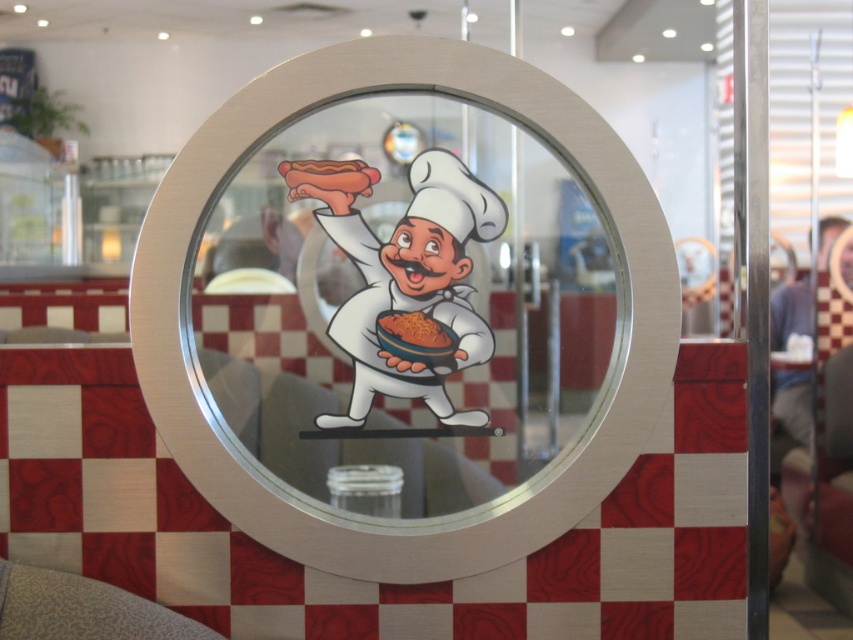
You are a customer looking through the diner window. You notice the white glossy chef at center and the matte hot dog at upper center. Which object is positioned to the right side of the other?

The white glossy chef at center is to the right of the matte hot dog at upper center.

You are standing in front of a diner window and want to take a photo of the chef illustration inside. The camera you are holding is at point (474,228). Is the distance between your camera and the chef illustration sufficient to capture the entire illustration in the photo?

The distance between the camera at point (474,228) and the chef illustration is 10.23 feet, which is sufficient to capture the entire illustration in the photo.

You are standing in front of the diner window and want to know where the chef is located. According to the coordinates provided, where exactly is the white glossy chef at center positioned?

The white glossy chef at center is positioned at the coordinates point (405, 276).